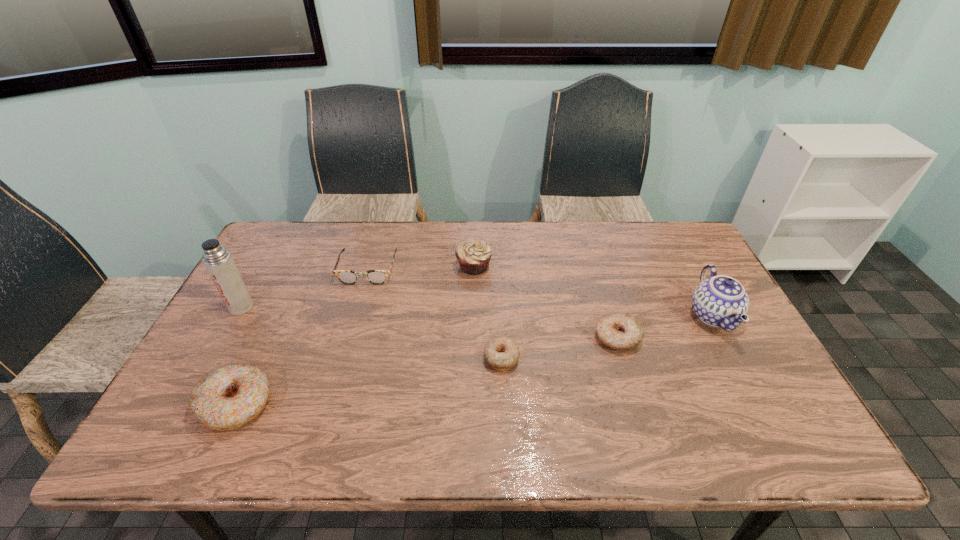
Identify the location of spectacles that is at the far edge. The height and width of the screenshot is (540, 960). (345, 276).

Where is `muffin situated at the far edge`? This screenshot has height=540, width=960. muffin situated at the far edge is located at coordinates (473, 255).

Where is `object that is at the near edge`? object that is at the near edge is located at coordinates (230, 396).

The width and height of the screenshot is (960, 540). I want to click on doughnut that is at the left edge, so click(230, 396).

Image resolution: width=960 pixels, height=540 pixels. I want to click on thermos bottle that is at the left edge, so click(219, 263).

Where is `object located in the right edge section of the desktop`? Image resolution: width=960 pixels, height=540 pixels. object located in the right edge section of the desktop is located at coordinates (720, 301).

Locate an element on the screen. The width and height of the screenshot is (960, 540). object located at the near left corner is located at coordinates (230, 396).

What are the coordinates of `free region at the far edge` in the screenshot? It's located at (645, 260).

In the image, there is a desktop. At what (x,y) coordinates should I click in order to perform the action: click on vacant area at the near edge. Please return your answer as a coordinate pair (x, y). The image size is (960, 540). Looking at the image, I should click on point(345,393).

I want to click on free region at the right edge of the desktop, so click(747, 342).